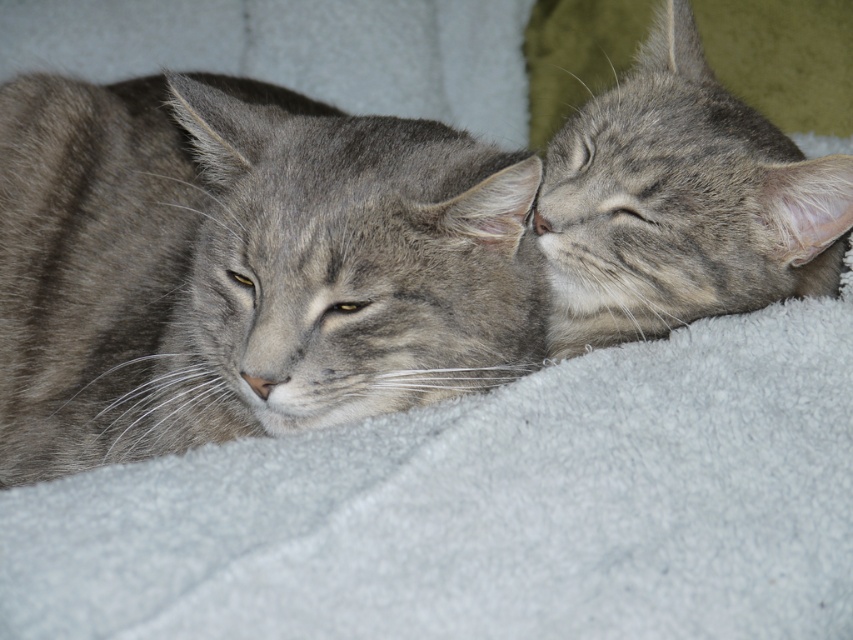
You are taking a photo of two cats resting on a blanket. You want to focus on the cat at point (73,396) and ensure the cat at point (653,93) is also in the frame. Given that your camera can focus on objects within a 0.5 unit range from the focal point, will both cats be in focus?

Point (73,396) is closer to the camera than point (653,93). The distance between the two points is sqrt

You are a veterinarian examining two cats in an image. The cats are the gray striped cat at left and the gray tabby cat at upper right. Which cat is bigger?

The gray striped cat at left is larger in size compared to the gray tabby cat at upper right.

In the scene shown: You are a cat owner trying to fit both your gray striped cat at left and gray tabby cat at upper right into a cat carrier that can only accommodate the wider of the two. Which cat should you prioritize placing first?

The gray striped cat at left is wider than the gray tabby cat at upper right, so you should prioritize placing the gray striped cat at left first to ensure it fits in the carrier.